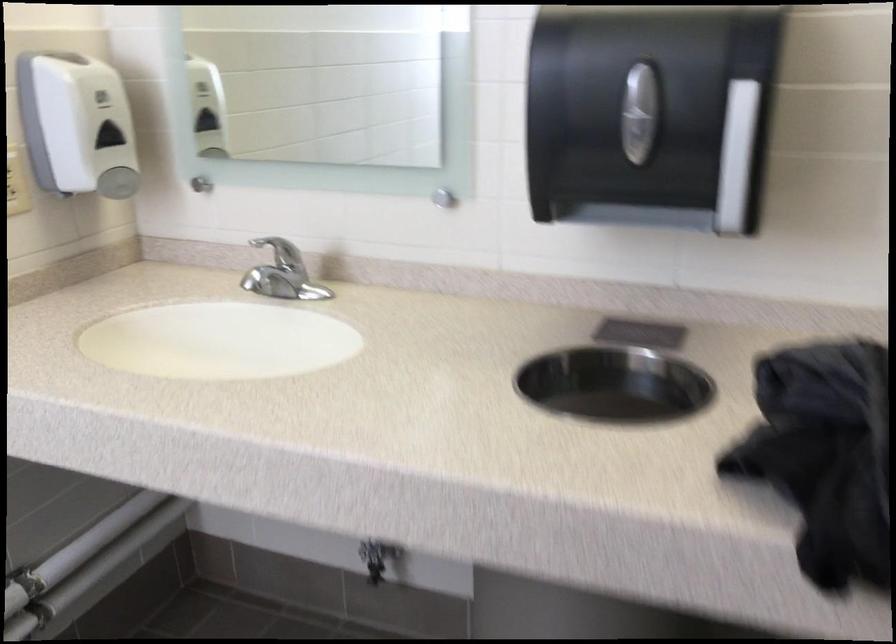
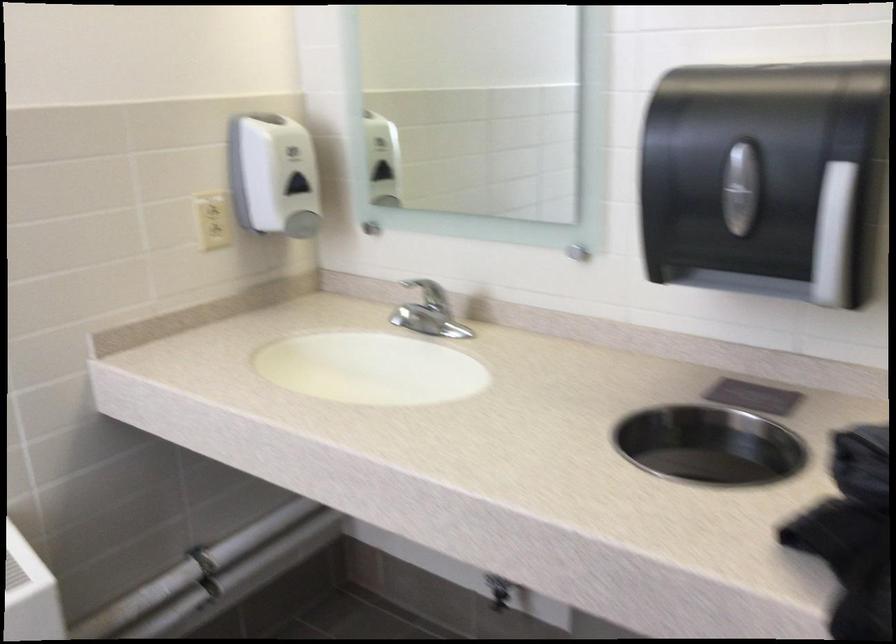
In the second image, find the point that corresponds to (x=116, y=185) in the first image.

(302, 223)